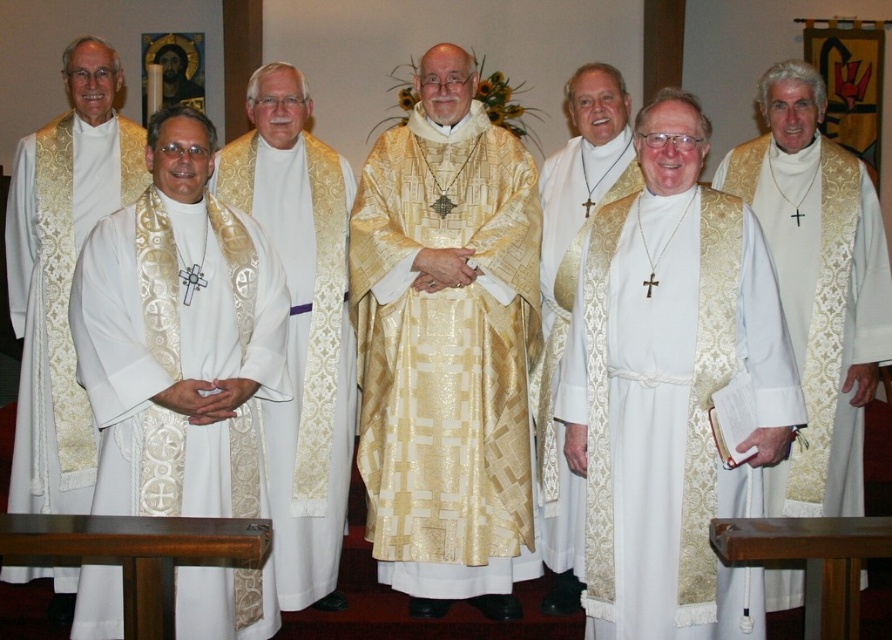
Question: Is white textured vestment at center bigger than gold textured vestment at center?

Choices:
 (A) yes
 (B) no

Answer: (A)

Question: Is gold textured vestment at center bigger than white textured vestment at left?

Choices:
 (A) no
 (B) yes

Answer: (B)

Question: Based on their relative distances, which object is farther from the white damask vestment at center?

Choices:
 (A) white textured fabric at center
 (B) white textured vestment at center
 (C) gold textured vestment at center
 (D) matte gold vestment at center

Answer: (A)

Question: Which of the following is the farthest from the observer?

Choices:
 (A) white textured vestment at center
 (B) white damask vestment at center

Answer: (A)

Question: Does white textured vestment at left appear on the right side of matte gold vestment at center?

Choices:
 (A) no
 (B) yes

Answer: (A)

Question: Which of these objects is positioned farthest from the gold textured robe at center?

Choices:
 (A) white textured fabric at center
 (B) matte gold vestment at center

Answer: (A)